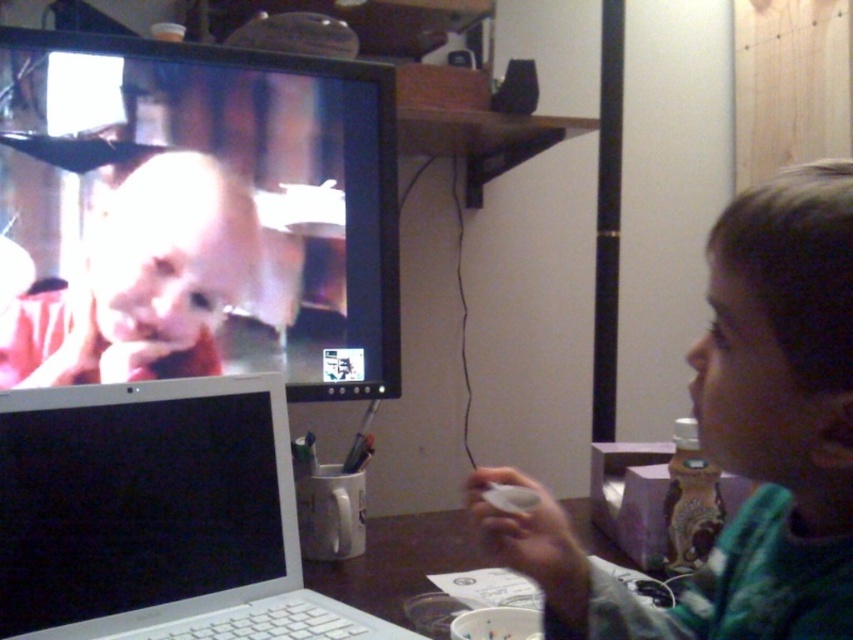
Is point (76, 428) in front of point (90, 340)?

Yes.

Consider the image. Is silver metallic laptop at lower left below smooth skin child at upper left?

Correct, silver metallic laptop at lower left is located below smooth skin child at upper left.

Which is behind, point (94, 400) or point (119, 296)?

The point (119, 296) is behind.

Where is `silver metallic laptop at lower left`? This screenshot has width=853, height=640. silver metallic laptop at lower left is located at coordinates (157, 516).

Does point (305, 115) lie in front of point (250, 193)?

That is False.

Which is below, matte black monitor at upper left or smooth skin child at upper left?

smooth skin child at upper left

Is point (376, 134) positioned before point (134, 220)?

No, it is behind (134, 220).

Find the location of `matte black monitor at upper left`. matte black monitor at upper left is located at coordinates (196, 214).

Is green plaid shirt at right closer to the viewer compared to smooth skin child at upper left?

Yes, green plaid shirt at right is in front of smooth skin child at upper left.

Can you confirm if green plaid shirt at right is wider than smooth skin child at upper left?

In fact, green plaid shirt at right might be narrower than smooth skin child at upper left.

Identify the location of green plaid shirt at right. The width and height of the screenshot is (853, 640). (740, 438).

Identify the location of green plaid shirt at right. (740, 438).